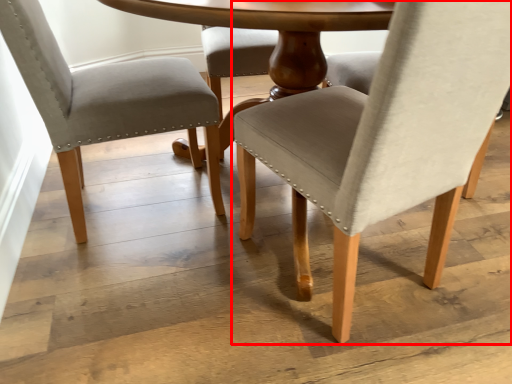
Question: From the image's perspective, what is the correct spatial positioning of chair (annotated by the red box) in reference to chair?

Choices:
 (A) above
 (B) below

Answer: (B)